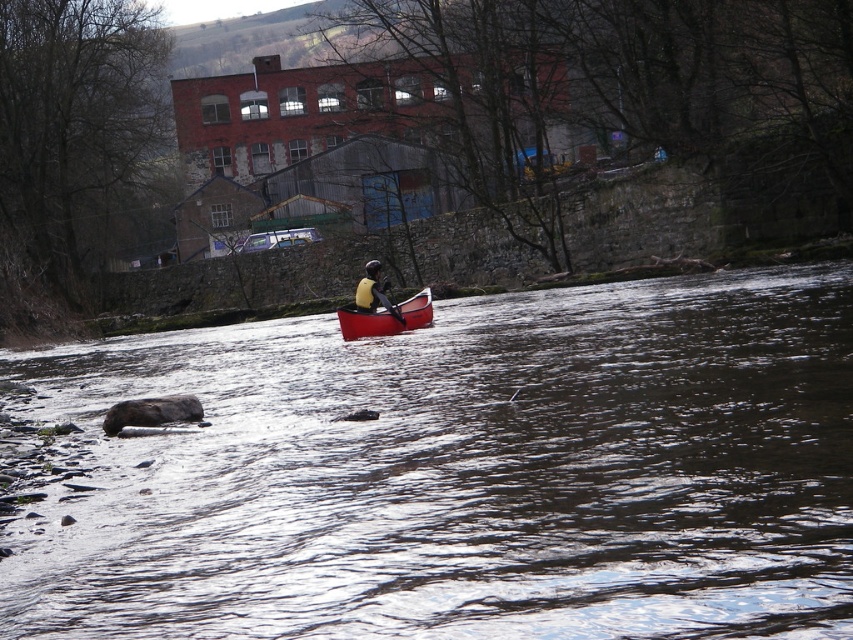
You are a kayaker preparing to board your vessel. You see the smooth red canoe at center and the black plastic paddle at center. Which item is closer to your current position?

The smooth red canoe at center and black plastic paddle at center are 58.68 centimeters apart from each other. Without knowing your exact position, it is impossible to determine which is closer.

You are planning to store the smooth red canoe at center and the matte yellow life vest at center in a storage shed. The shed has a 1.2 meter wide entrance. Can both items fit through the entrance if placed side by side?

The smooth red canoe at center is wider than the matte yellow life vest at center. Since the entrance is 1.2 meters wide, we need to know the combined width of both items to determine if they can fit side by side. However, the exact widths are not provided, so it is impossible to confirm without additional information.

You are planning to store the smooth red canoe at center and the matte yellow life vest at center in a storage locker. The locker has a length of 1.5 meters. Can both items fit side by side in the locker without overlapping?

The smooth red canoe at center is shorter than the matte yellow life vest at center. However, since the total length of both items combined may exceed the locker length of 1.5 meters, it is uncertain if they can fit side by side without overlapping. More information about their individual lengths is needed.